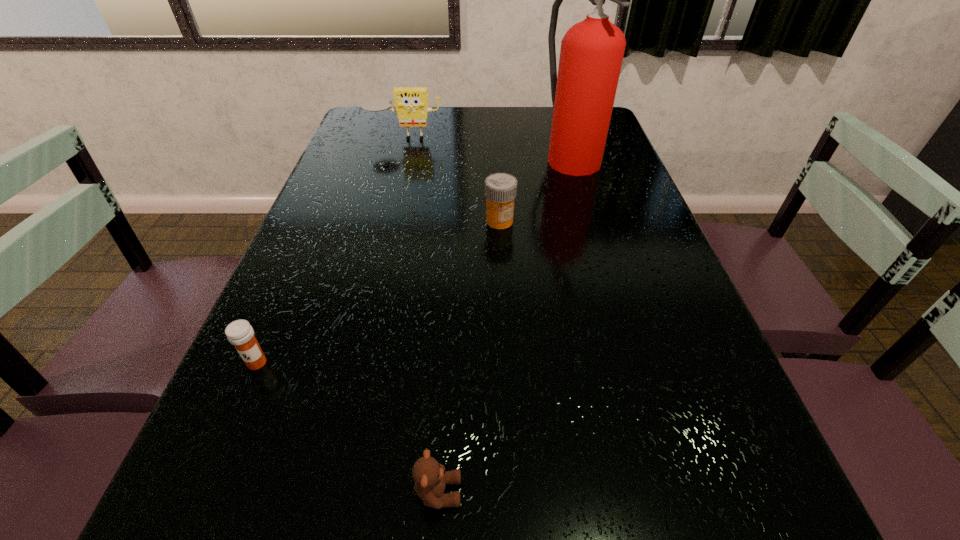
Where is `free area in between the teddy bear and the third nearest object`? The image size is (960, 540). free area in between the teddy bear and the third nearest object is located at coordinates (468, 356).

Locate an element on the screen. This screenshot has width=960, height=540. free spot between the third object from right to left and the third nearest object is located at coordinates (468, 356).

The image size is (960, 540). I want to click on blank region between the tallest object and the fourth shortest object, so click(488, 146).

Locate an element on the screen. The height and width of the screenshot is (540, 960). free point between the shorter medicine and the teddy bear is located at coordinates (348, 427).

Find the location of a particular element. This screenshot has width=960, height=540. unoccupied position between the left medicine and the rightmost object is located at coordinates (414, 259).

I want to click on vacant area that lies between the tallest object and the nearer medicine, so click(414, 259).

Locate an element on the screen. This screenshot has width=960, height=540. object that can be found as the closest to the fourth object from right to left is located at coordinates (583, 93).

Where is `object that can be found as the closest to the farther medicine`? object that can be found as the closest to the farther medicine is located at coordinates (583, 93).